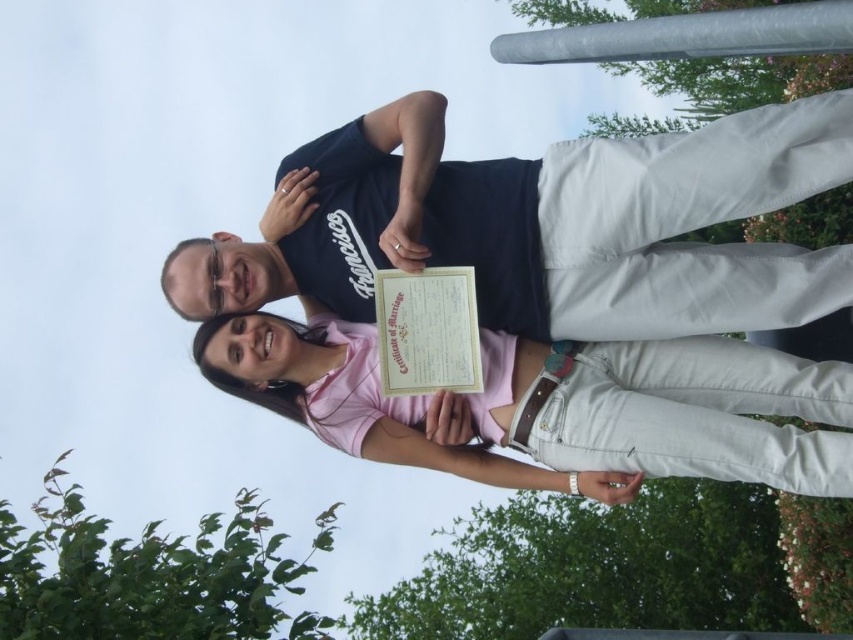
Question: Which point is closer to the camera?

Choices:
 (A) pink cotton shirt at center
 (B) dark blue t-shirt at center

Answer: (A)

Question: Is dark blue t-shirt at center to the left of yellow paper certificate at center from the viewer's perspective?

Choices:
 (A) yes
 (B) no

Answer: (A)

Question: Which point appears farthest from the camera in this image?

Choices:
 (A) (648, 371)
 (B) (433, 301)
 (C) (585, 240)

Answer: (A)

Question: Which point is closer to the camera taking this photo?

Choices:
 (A) [x=825, y=120]
 (B) [x=724, y=428]

Answer: (A)

Question: Does dark blue t-shirt at center appear under yellow paper certificate at center?

Choices:
 (A) no
 (B) yes

Answer: (A)

Question: Is dark blue t-shirt at center to the right of yellow paper certificate at center from the viewer's perspective?

Choices:
 (A) no
 (B) yes

Answer: (A)